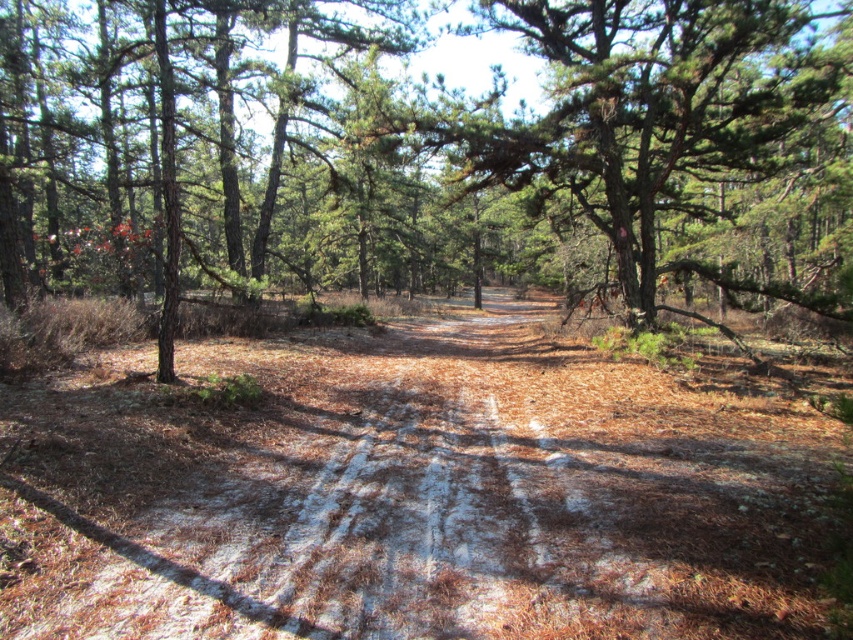
You are a hiker trying to determine the best path through the forest. You see a brown dirt track at center and a green rough bark tree at center. Which one is taller?

The brown dirt track at center is not as tall as the green rough bark tree at center, so the green rough bark tree at center is taller.

Consider the image. You are a hiker walking along the brown dirt track at center in the forest. You notice the green rough bark tree at center above you. Can you determine if the tree is directly above the track?

The brown dirt track at center is positioned under the green rough bark tree at center, so yes, the tree is directly above the track.